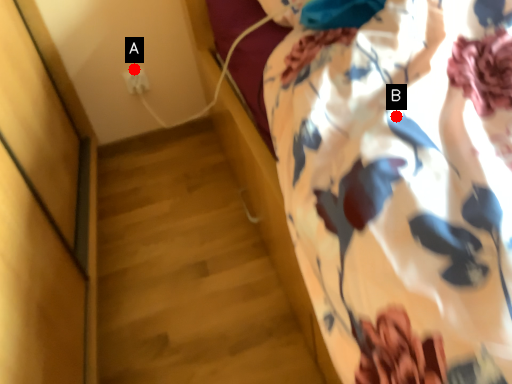
Question: Two points are circled on the image, labeled by A and B beside each circle. Among these points, which one is farthest from the camera?

Choices:
 (A) A is further
 (B) B is further

Answer: (A)